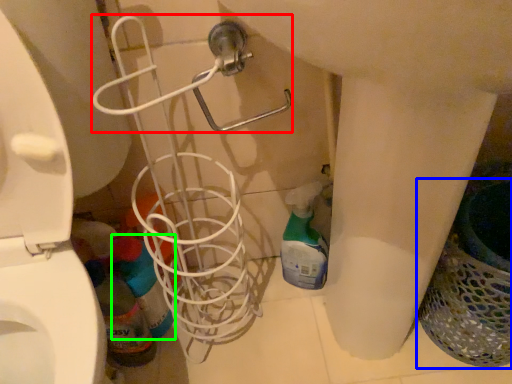
Question: Estimate the real-world distances between objects in this image. Which object is farther from shower (highlighted by a red box), laundry basket (highlighted by a blue box) or cleaning product (highlighted by a green box)?

Choices:
 (A) laundry basket
 (B) cleaning product

Answer: (A)